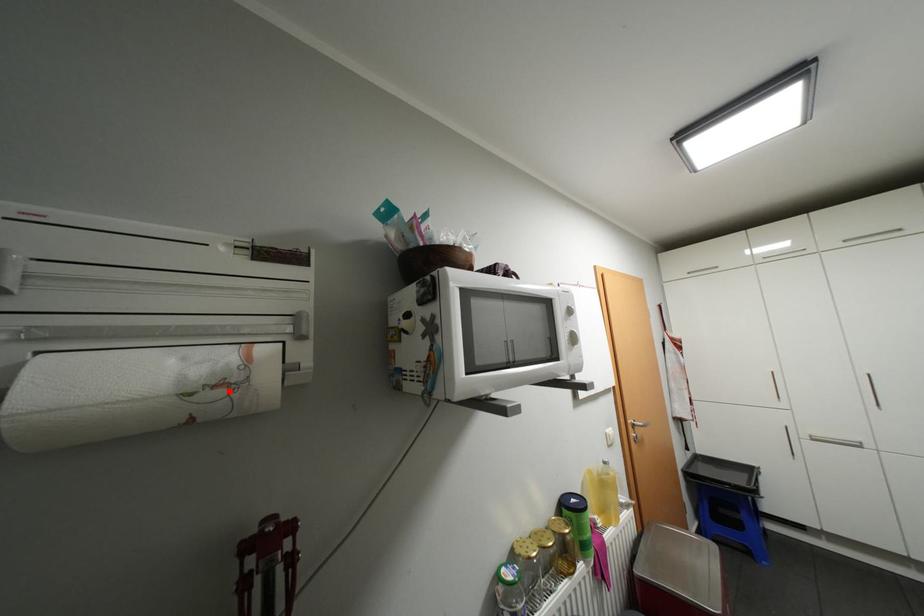
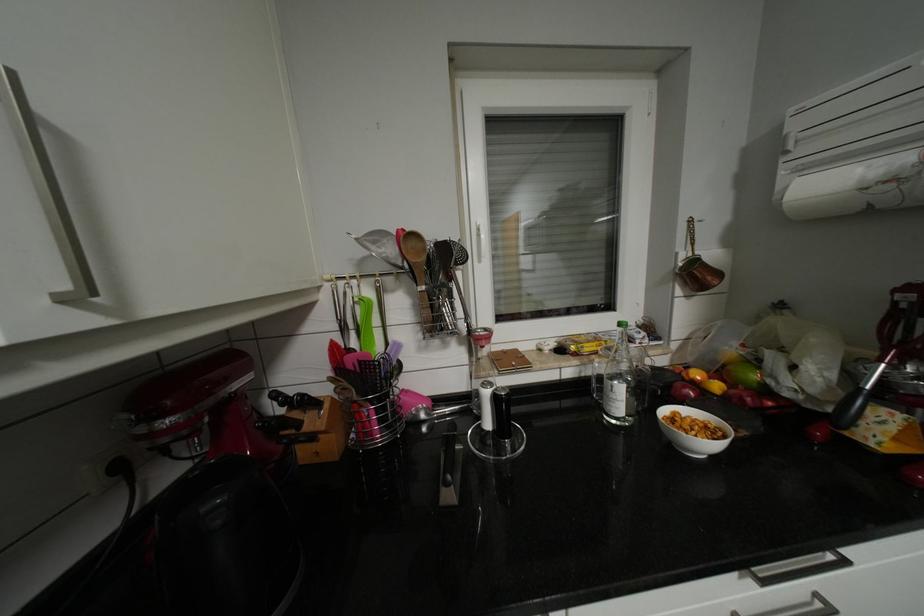
The point at the highlighted location is marked in the first image. Where is the corresponding point in the second image?

(898, 185)